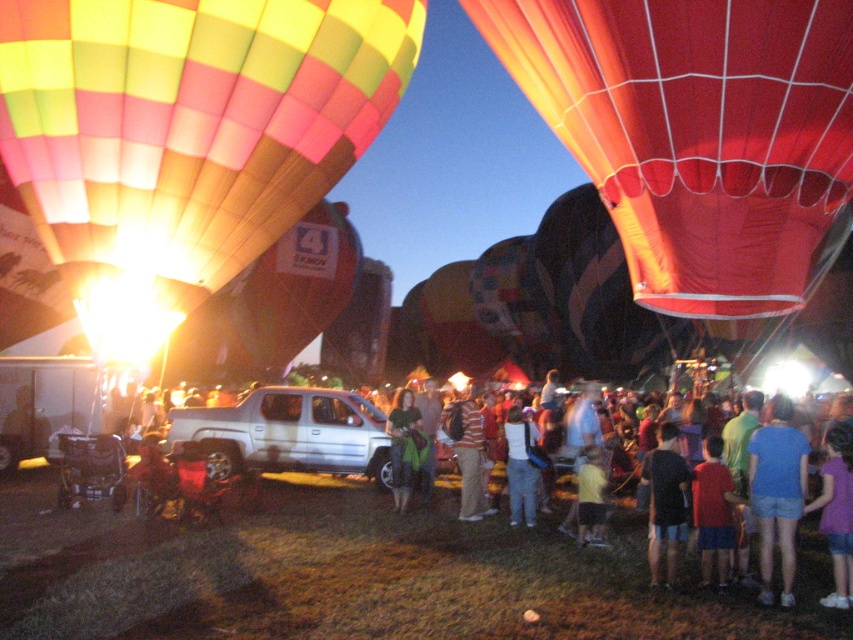
Can you confirm if red fabric balloon at upper right is bigger than orange striped shirt at center?

No, red fabric balloon at upper right is not bigger than orange striped shirt at center.

Between point (663, 256) and point (444, 413), which one is positioned behind?

Positioned behind is point (444, 413).

Where is `red fabric balloon at upper right`? The width and height of the screenshot is (853, 640). red fabric balloon at upper right is located at coordinates (695, 132).

Is point (791, 442) positioned after point (526, 442)?

No, (791, 442) is in front of (526, 442).

Can you confirm if multicolored fabric crowd at center is thinner than white cotton shirt at center?

Incorrect, multicolored fabric crowd at center's width is not less than white cotton shirt at center's.

Between point (654, 490) and point (514, 429), which one is positioned in front?

Point (654, 490) is more forward.

At what (x,y) coordinates should I click in order to perform the action: click on multicolored fabric crowd at center. Please return your answer as a coordinate pair (x, y). Looking at the image, I should click on (752, 499).

Is matte black balloon at center closer to camera compared to purple cotton shirt at lower right?

No.

Is matte black balloon at center wider than purple cotton shirt at lower right?

Correct, the width of matte black balloon at center exceeds that of purple cotton shirt at lower right.

Between point (556, 221) and point (839, 563), which one is positioned in front?

Point (839, 563) is in front.

The image size is (853, 640). Find the location of `matte black balloon at center`. matte black balloon at center is located at coordinates (598, 296).